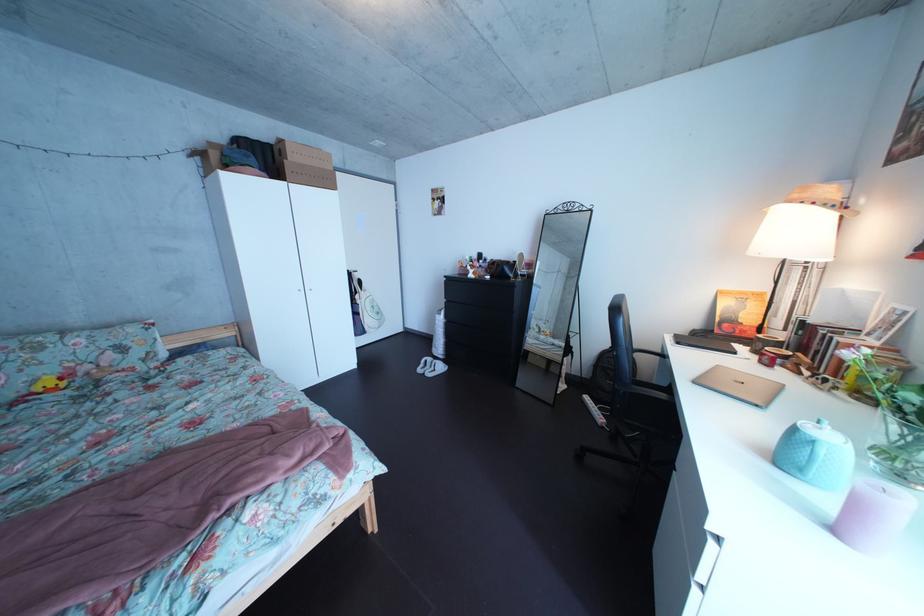
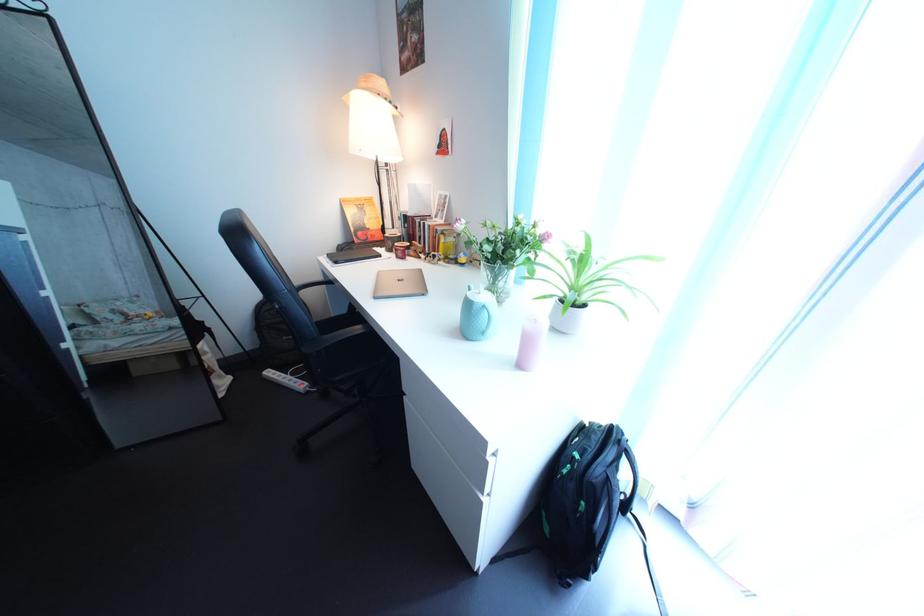
How did the camera likely rotate?

The camera's rotation is toward right-down.